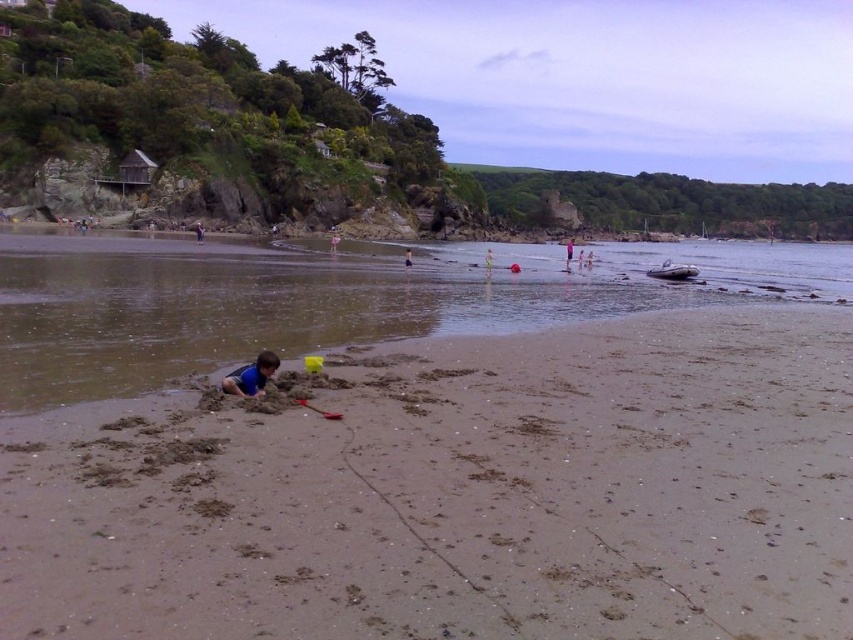
Question: Which point is closer to the camera?

Choices:
 (A) (491, 266)
 (B) (405, 250)
 (C) (354, 248)
 (D) (567, 244)

Answer: (A)

Question: Can you confirm if blue fabric boy at lower left is positioned to the left of green fabric shorts at center?

Choices:
 (A) no
 (B) yes

Answer: (B)

Question: Which object is the farthest from the blue fabric person at center?

Choices:
 (A) blue fabric person at lower left
 (B) brown sandy beach at lower left

Answer: (B)

Question: Can you confirm if green fabric shorts at center is wider than blue fabric person at center?

Choices:
 (A) yes
 (B) no

Answer: (A)

Question: Which object is positioned farthest from the blue fabric person at lower left?

Choices:
 (A) blue fabric boy at lower left
 (B) light pink fabric at center
 (C) blue fabric person at center
 (D) brown sand at lower left

Answer: (A)

Question: Is blue fabric boy at lower left smaller than blue fabric person at center?

Choices:
 (A) yes
 (B) no

Answer: (A)